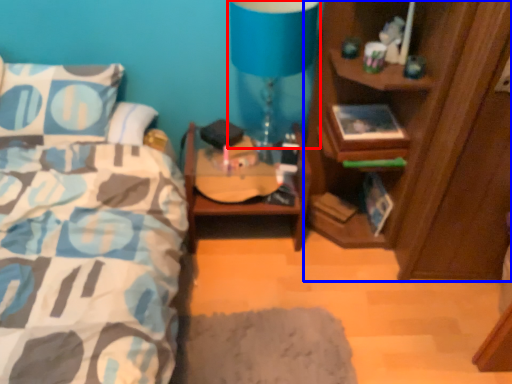
Question: Which of the following is the closest to the observer, table lamp (highlighted by a red box) or cabinetry (highlighted by a blue box)?

Choices:
 (A) table lamp
 (B) cabinetry

Answer: (B)